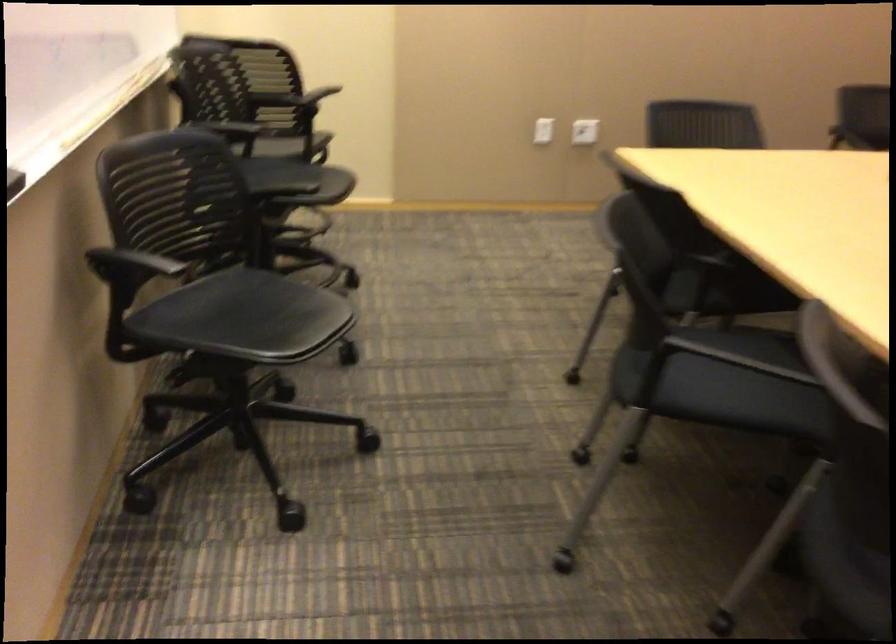
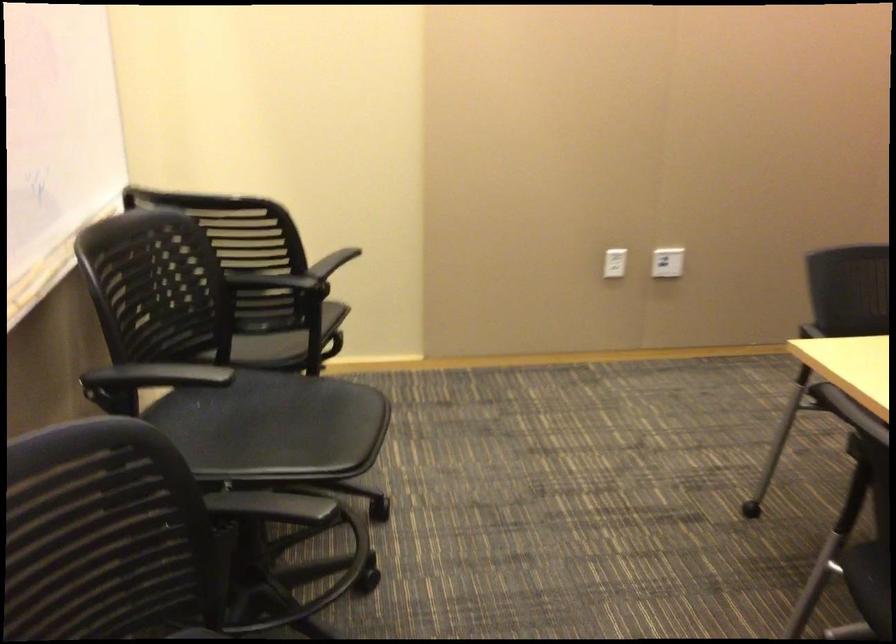
Question: Which direction would the cameraman need to move to produce the second image? Reply with the corresponding letter.

Choices:
 (A) Left
 (B) Right
 (C) Forward
 (D) Backward

Answer: (C)